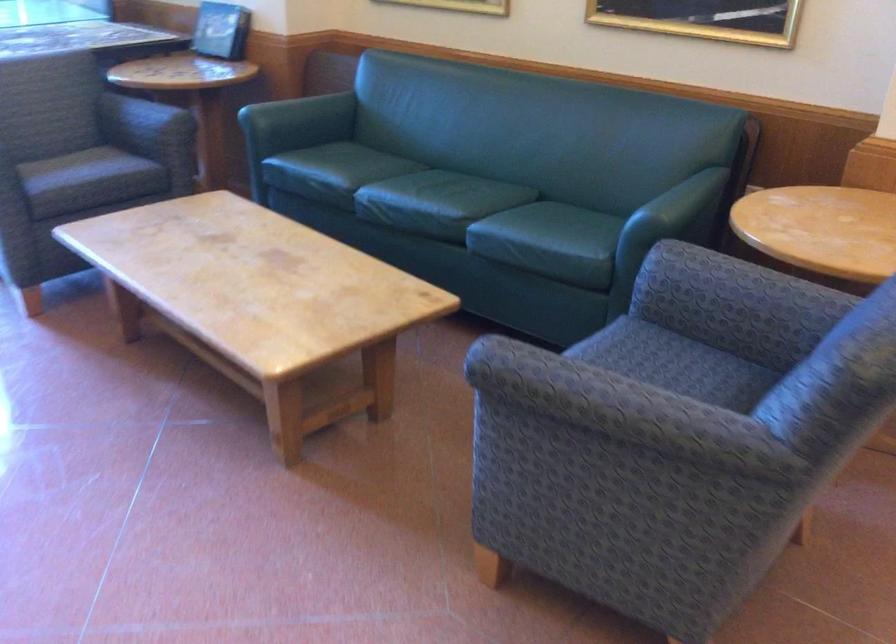
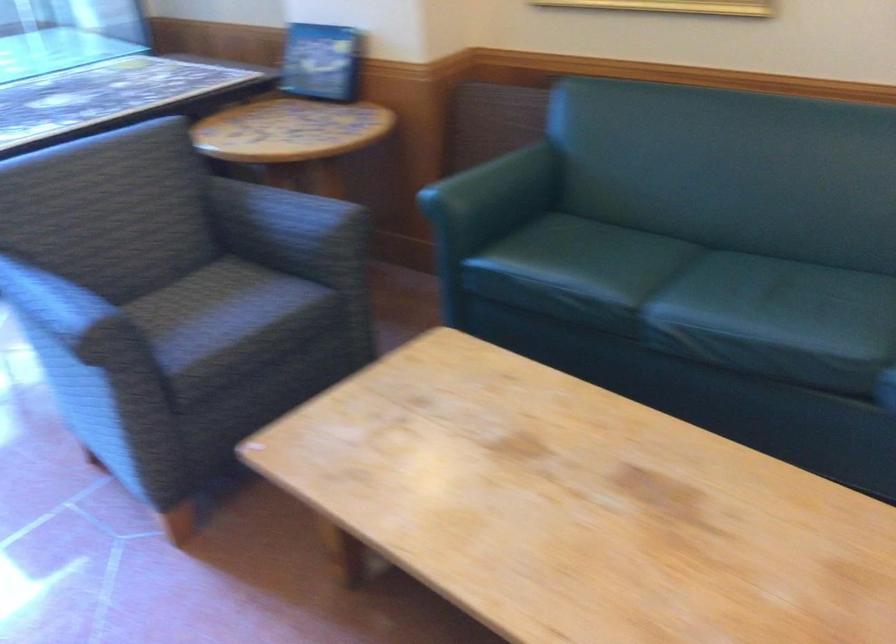
Where in the second image is the point corresponding to (x=295, y=107) from the first image?

(496, 182)